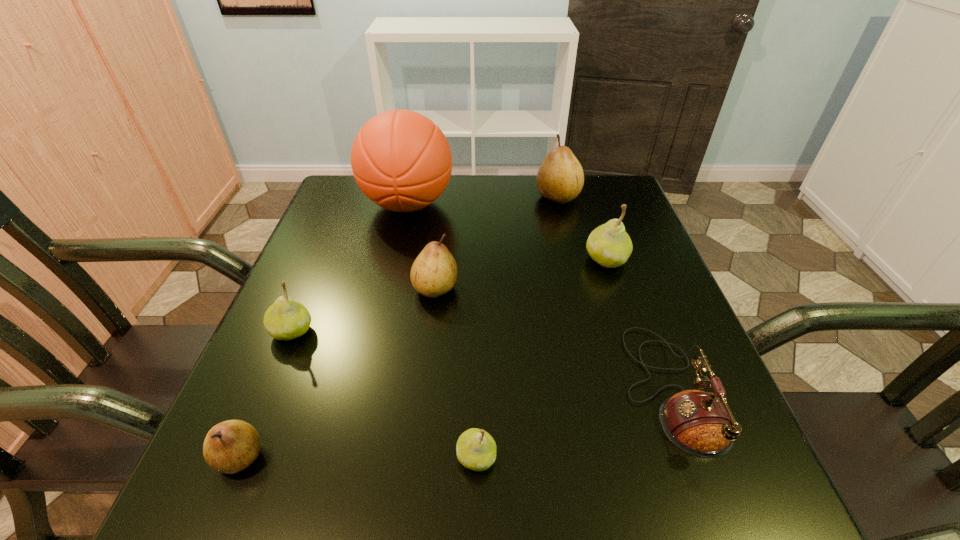
Identify which object is the closest to the tallest object. Please provide its 2D coordinates. Your answer should be formatted as a tuple, i.e. [(x, y)], where the tuple contains the x and y coordinates of a point satisfying the conditions above.

[(434, 272)]

Identify which object is the second closest to the nearest brown pear. Please provide its 2D coordinates. Your answer should be formatted as a tuple, i.e. [(x, y)], where the tuple contains the x and y coordinates of a point satisfying the conditions above.

[(476, 449)]

At what (x,y) coordinates should I click in order to perform the action: click on pear that is the third closest to the rightmost green pear. Please return your answer as a coordinate pair (x, y). Looking at the image, I should click on (476, 449).

Where is `pear that is the fourth closest to the third pear from left to right`? This screenshot has height=540, width=960. pear that is the fourth closest to the third pear from left to right is located at coordinates (560, 178).

I want to click on brown pear identified as the closest to the leftmost green pear, so click(x=231, y=446).

Where is `brown pear that can be found as the closest to the fifth object from left to right`? brown pear that can be found as the closest to the fifth object from left to right is located at coordinates (231, 446).

At what (x,y) coordinates should I click in order to perform the action: click on the third closest green pear relative to the biggest brown pear. Please return your answer as a coordinate pair (x, y). The height and width of the screenshot is (540, 960). Looking at the image, I should click on (476, 449).

Select which green pear is the closest to the fifth object from left to right. Please provide its 2D coordinates. Your answer should be formatted as a tuple, i.e. [(x, y)], where the tuple contains the x and y coordinates of a point satisfying the conditions above.

[(286, 319)]

Locate an element on the screen. Image resolution: width=960 pixels, height=540 pixels. free space that satisfies the following two spatial constraints: 1. on the front side of the rightmost brown pear; 2. on the right side of the rightmost green pear is located at coordinates (573, 260).